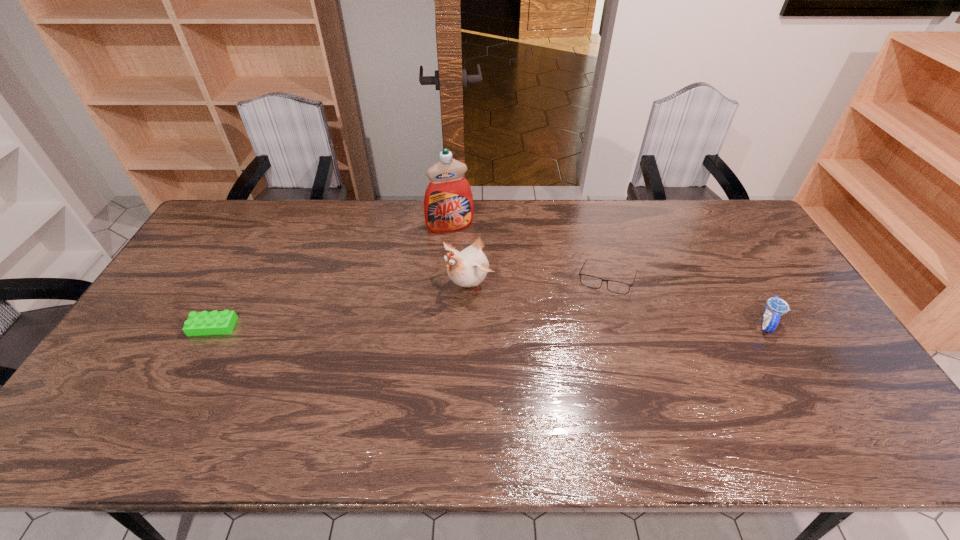
I want to click on object that is the nearest to the third tallest object, so click(x=590, y=281).

You are a GUI agent. You are given a task and a screenshot of the screen. Output one action in this format:
    pyautogui.click(x=<x>, y=<y>)
    Task: Click on the free space that satisfies the following two spatial constraints: 1. on the front side of the rightmost object; 2. on the left side of the second object from right to left
    This screenshot has width=960, height=540.
    Given the screenshot: What is the action you would take?
    pyautogui.click(x=618, y=322)

Find the location of a particular element. free space that satisfies the following two spatial constraints: 1. on the back side of the spectacles; 2. on the left side of the fourth shortest object is located at coordinates (470, 281).